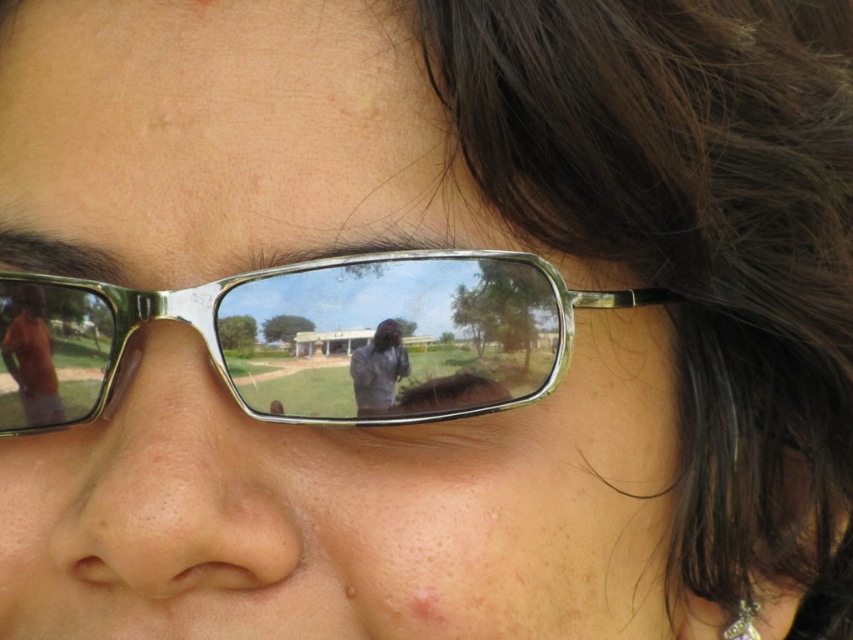
Question: Among these objects, which one is nearest to the camera?

Choices:
 (A) silver metallic earring at lower right
 (B) matte skin nose at center
 (C) metallic frame glasses at center

Answer: (B)

Question: Does matte black shirt at center have a smaller size compared to silver metallic earring at lower right?

Choices:
 (A) no
 (B) yes

Answer: (B)

Question: Considering the real-world distances, which object is closest to the metallic frame glasses at center?

Choices:
 (A) silver metallic earring at lower right
 (B) pink matte freckle at lower center

Answer: (B)

Question: Which object appears farthest from the camera in this image?

Choices:
 (A) metallic frame glasses at center
 (B) silver metallic earring at lower right
 (C) matte black shirt at center
 (D) pink matte freckle at lower center

Answer: (B)

Question: Can you confirm if matte skin nose at center is bigger than silver metallic earring at lower right?

Choices:
 (A) yes
 (B) no

Answer: (A)

Question: Is matte black shirt at center positioned at the back of silver metallic earring at lower right?

Choices:
 (A) no
 (B) yes

Answer: (A)